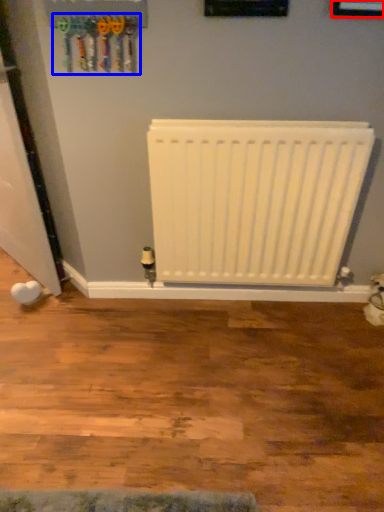
Question: Which of the following is the closest to the observer, picture frame (highlighted by a red box) or tool (highlighted by a blue box)?

Choices:
 (A) picture frame
 (B) tool

Answer: (A)